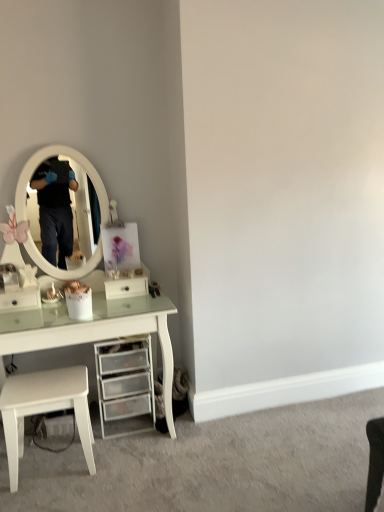
What is the approximate width of white glossy drawer at center, marked as the second drawer in a left-to-right arrangement?

It is 7.04 inches.

Where is `white glossy drawer at left, which is the first drawer in left-to-right order`? The image size is (384, 512). white glossy drawer at left, which is the first drawer in left-to-right order is located at coordinates (20, 298).

Where is `white glossy drawer at center, the 1th drawer positioned from the right`? This screenshot has width=384, height=512. white glossy drawer at center, the 1th drawer positioned from the right is located at coordinates (126, 287).

From the image's perspective, is clear plastic drawers at lower center under white matte stool at lower left?

Actually, clear plastic drawers at lower center appears above white matte stool at lower left in the image.

In order to click on stool on the left of clear plastic drawers at lower center in this screenshot , I will do `click(44, 409)`.

Does point (134, 388) appear closer or farther from the camera than point (20, 379)?

Point (134, 388) is positioned farther from the camera compared to point (20, 379).

How different are the orientations of white glossy drawer at left, which appears as the 2th drawer when viewed from the right, and clear plastic drawers at lower center in degrees?

The facing directions of white glossy drawer at left, which appears as the 2th drawer when viewed from the right, and clear plastic drawers at lower center are 0.879 degrees apart.

Looking at this image, which of these two, white glossy drawer at left, which is the first drawer in left-to-right order, or clear plastic drawers at lower center, is thinner?

Thinner between the two is white glossy drawer at left, which is the first drawer in left-to-right order.

Is white glossy drawer at left, which appears as the 2th drawer when viewed from the right, oriented away from clear plastic drawers at lower center?

white glossy drawer at left, which appears as the 2th drawer when viewed from the right, does not have its back to clear plastic drawers at lower center.

Is white glossy drawer at left, which is the first drawer in left-to-right order, bigger or smaller than clear plastic drawers at lower center?

Considering their sizes, white glossy drawer at left, which is the first drawer in left-to-right order, takes up less space than clear plastic drawers at lower center.

Would you say white glossy drawer at left, which appears as the 2th drawer when viewed from the right, is part of white glossy drawer at center, marked as the second drawer in a left-to-right arrangement,'s contents?

No, white glossy drawer at left, which appears as the 2th drawer when viewed from the right, is located outside of white glossy drawer at center, marked as the second drawer in a left-to-right arrangement.

Is white glossy drawer at center, marked as the second drawer in a left-to-right arrangement, taller than white glossy drawer at left, which appears as the 2th drawer when viewed from the right?

In fact, white glossy drawer at center, marked as the second drawer in a left-to-right arrangement, may be shorter than white glossy drawer at left, which appears as the 2th drawer when viewed from the right.

Looking at this image, what's the angular difference between white glossy drawer at center, marked as the second drawer in a left-to-right arrangement, and white glossy drawer at left, which appears as the 2th drawer when viewed from the right,'s facing directions?

They differ by 2.86 degrees in their facing directions.

From the image's perspective, between white glossy drawer at center, marked as the second drawer in a left-to-right arrangement, and white glossy drawer at left, which is the first drawer in left-to-right order, who is located below?

white glossy drawer at left, which is the first drawer in left-to-right order.

Is white glossy drawer at center, the 1th drawer positioned from the right, bigger or smaller than white matte stool at lower left?

white glossy drawer at center, the 1th drawer positioned from the right, is smaller than white matte stool at lower left.

From a real-world perspective, is white glossy drawer at center, the 1th drawer positioned from the right, located beneath white matte stool at lower left?

No, from a real-world perspective, white glossy drawer at center, the 1th drawer positioned from the right, is not below white matte stool at lower left.

Is white glossy drawer at center, the 1th drawer positioned from the right, to the right of white matte stool at lower left from the viewer's perspective?

Yes.

How distant is white glossy drawer at center, the 1th drawer positioned from the right, from white matte stool at lower left?

They are 23.53 inches apart.

Is white matte stool at lower left closer to the viewer compared to white glossy drawer at center, the 1th drawer positioned from the right?

Yes, it is.

Between white matte stool at lower left and white glossy drawer at center, the 1th drawer positioned from the right, which one has smaller size?

Smaller between the two is white glossy drawer at center, the 1th drawer positioned from the right.

Does white matte stool at lower left have a greater height compared to white glossy drawer at center, marked as the second drawer in a left-to-right arrangement?

Yes, white matte stool at lower left is taller than white glossy drawer at center, marked as the second drawer in a left-to-right arrangement.

Is white glossy drawer at center, the 1th drawer positioned from the right, located outside clear plastic drawers at lower center?

Yes, white glossy drawer at center, the 1th drawer positioned from the right, is not within clear plastic drawers at lower center.

Is the surface of white glossy drawer at center, the 1th drawer positioned from the right, in direct contact with clear plastic drawers at lower center?

No.

From the image's perspective, count 2nd drawers upward from the clear plastic drawers at lower center and point to it. Please provide its 2D coordinates.

[(126, 287)]

Consider the image. Which is less distant, (128, 362) or (121, 282)?

Point (128, 362)

Consider the image. Considering the sizes of objects clear plastic drawers at lower center and white glossy drawer at center, the 1th drawer positioned from the right, in the image provided, who is taller, clear plastic drawers at lower center or white glossy drawer at center, the 1th drawer positioned from the right,?

clear plastic drawers at lower center is taller.

From the image's perspective, count 2nd drawers upward from the clear plastic drawers at lower center and point to it. Please provide its 2D coordinates.

[(126, 287)]

Are clear plastic drawers at lower center and white glossy drawer at center, marked as the second drawer in a left-to-right arrangement, far apart?

clear plastic drawers at lower center is near white glossy drawer at center, marked as the second drawer in a left-to-right arrangement, not far away.

Identify the location of the chest of drawers that is above the white matte stool at lower left (from a real-world perspective). (125, 381).

What are the coordinates of `the chest of drawers located below the white glossy drawer at left, which is the first drawer in left-to-right order (from the image's perspective)` in the screenshot? It's located at pos(125,381).

When comparing their distances from white glossy drawer at center, marked as the second drawer in a left-to-right arrangement, does clear plastic drawers at lower center or white glossy drawer at left, which appears as the 2th drawer when viewed from the right, seem further?

Based on the image, white glossy drawer at left, which appears as the 2th drawer when viewed from the right, appears to be further to white glossy drawer at center, marked as the second drawer in a left-to-right arrangement.

Based on their spatial positions, is clear plastic drawers at lower center or white glossy drawer at center, the 1th drawer positioned from the right, closer to white glossy drawer at left, which is the first drawer in left-to-right order?

The object closer to white glossy drawer at left, which is the first drawer in left-to-right order, is white glossy drawer at center, the 1th drawer positioned from the right.

In the scene shown: Considering their positions, is clear plastic drawers at lower center positioned closer to white matte stool at lower left than white glossy drawer at left, which is the first drawer in left-to-right order?

Based on the image, clear plastic drawers at lower center appears to be nearer to white matte stool at lower left.

Based on their spatial positions, is white matte stool at lower left or white glossy drawer at center, the 1th drawer positioned from the right, closer to clear plastic drawers at lower center?

The object closer to clear plastic drawers at lower center is white matte stool at lower left.

Estimate the real-world distances between objects in this image. Which object is closer to white glossy drawer at left, which appears as the 2th drawer when viewed from the right, white glossy drawer at center, the 1th drawer positioned from the right, or clear plastic drawers at lower center?

white glossy drawer at center, the 1th drawer positioned from the right, is closer to white glossy drawer at left, which appears as the 2th drawer when viewed from the right.

From the image, which object appears to be farther from clear plastic drawers at lower center, white glossy drawer at center, marked as the second drawer in a left-to-right arrangement, or white glossy drawer at left, which appears as the 2th drawer when viewed from the right?

Based on the image, white glossy drawer at left, which appears as the 2th drawer when viewed from the right, appears to be further to clear plastic drawers at lower center.

When comparing their distances from white glossy drawer at left, which is the first drawer in left-to-right order, does clear plastic drawers at lower center or white matte stool at lower left seem further?

clear plastic drawers at lower center lies further to white glossy drawer at left, which is the first drawer in left-to-right order, than the other object.

Considering their positions, is white matte stool at lower left positioned further to white glossy drawer at center, marked as the second drawer in a left-to-right arrangement, than clear plastic drawers at lower center?

Based on the image, white matte stool at lower left appears to be further to white glossy drawer at center, marked as the second drawer in a left-to-right arrangement.

I want to click on the chest of drawers situated between white glossy drawer at left, which appears as the 2th drawer when viewed from the right, and white glossy drawer at center, marked as the second drawer in a left-to-right arrangement, from left to right, so click(x=125, y=381).

Locate an element on the screen. drawer between white glossy drawer at center, the 1th drawer positioned from the right, and white matte stool at lower left from top to bottom is located at coordinates (20, 298).

The width and height of the screenshot is (384, 512). In order to click on chest of drawers between white glossy drawer at center, marked as the second drawer in a left-to-right arrangement, and white matte stool at lower left, in the vertical direction in this screenshot , I will do `click(125, 381)`.

You are a GUI agent. You are given a task and a screenshot of the screen. Output one action in this format:
    pyautogui.click(x=<x>, y=<y>)
    Task: Click on the chest of drawers between white glossy drawer at left, which appears as the 2th drawer when viewed from the right, and white matte stool at lower left, in the vertical direction
    The height and width of the screenshot is (512, 384).
    Given the screenshot: What is the action you would take?
    pyautogui.click(x=125, y=381)